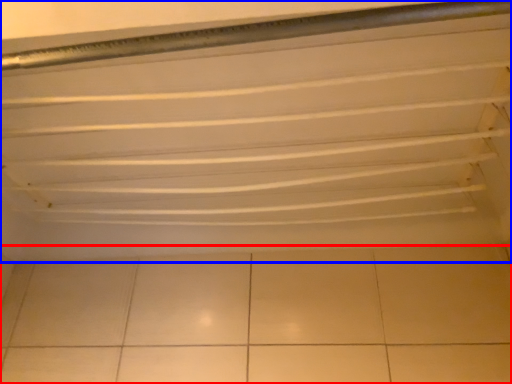
Question: Which point is further to the camera, ceramic tile (highlighted by a red box) or shelf (highlighted by a blue box)?

Choices:
 (A) ceramic tile
 (B) shelf

Answer: (A)